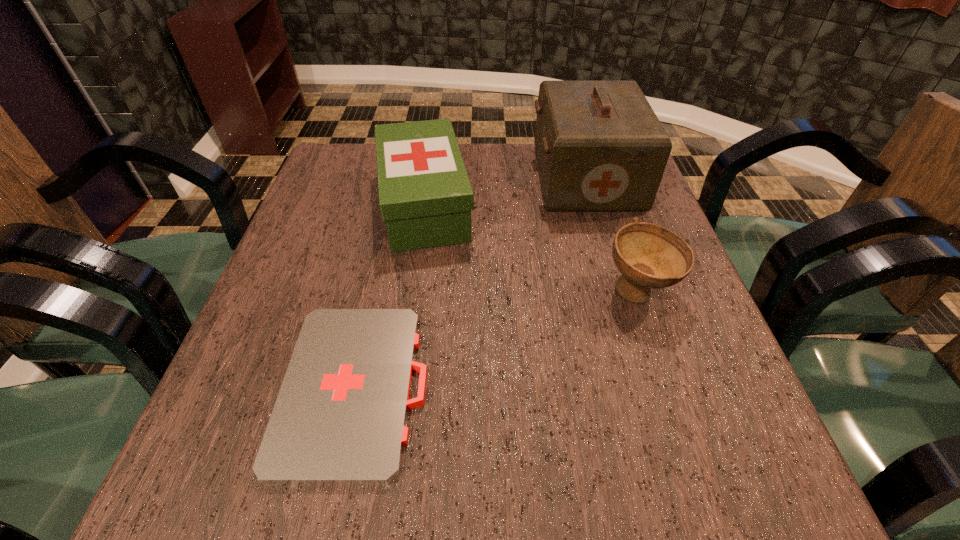
Locate an element on the screen. The image size is (960, 540). vacant space at the far left corner of the desktop is located at coordinates (350, 179).

Identify the location of free space at the near right corner. This screenshot has width=960, height=540. (693, 500).

Identify the location of free spot between the nearest first-aid kit and the soup bowl. The height and width of the screenshot is (540, 960). point(497,340).

Locate an element on the screen. The height and width of the screenshot is (540, 960). vacant space that is in between the soup bowl and the nearest first-aid kit is located at coordinates (497, 340).

The width and height of the screenshot is (960, 540). What are the coordinates of `blank region between the tallest first-aid kit and the nearest first-aid kit` in the screenshot? It's located at (470, 282).

The image size is (960, 540). I want to click on free space between the second tallest first-aid kit and the nearest first-aid kit, so click(x=390, y=296).

At what (x,y) coordinates should I click in order to perform the action: click on blank region between the tallest first-aid kit and the nearest first-aid kit. Please return your answer as a coordinate pair (x, y). Looking at the image, I should click on (470, 282).

This screenshot has height=540, width=960. I want to click on free space between the tallest first-aid kit and the nearest first-aid kit, so click(470, 282).

I want to click on vacant area that lies between the soup bowl and the nearest first-aid kit, so click(x=497, y=340).

Locate an element on the screen. vacant area that lies between the shortest first-aid kit and the second shortest first-aid kit is located at coordinates (390, 296).